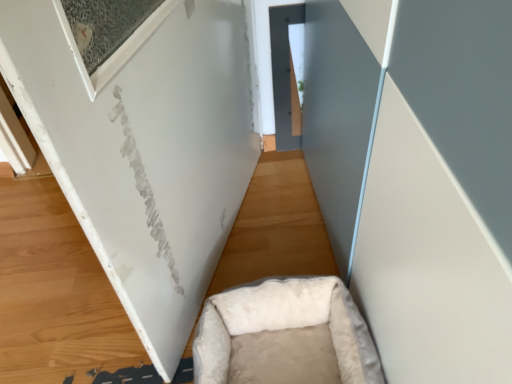
Question: From their relative heights in the image, would you say white fluffy pet bed at lower center is taller or shorter than white plush pet bed at lower center?

Choices:
 (A) tall
 (B) short

Answer: (B)

Question: Is point (101, 339) closer or farther from the camera than point (357, 377)?

Choices:
 (A) closer
 (B) farther

Answer: (B)

Question: Relative to white plush pet bed at lower center, is white fluffy pet bed at lower center in front or behind?

Choices:
 (A) front
 (B) behind

Answer: (B)

Question: Looking at the image, does white plush pet bed at lower center seem bigger or smaller compared to white fluffy pet bed at lower center?

Choices:
 (A) small
 (B) big

Answer: (A)

Question: Is point (x=369, y=352) positioned closer to the camera than point (x=218, y=283)?

Choices:
 (A) closer
 (B) farther

Answer: (A)

Question: Choose the correct answer: Is white plush pet bed at lower center inside white fluffy pet bed at lower center or outside it?

Choices:
 (A) inside
 (B) outside

Answer: (B)

Question: From a real-world perspective, is white plush pet bed at lower center positioned above or below white fluffy pet bed at lower center?

Choices:
 (A) below
 (B) above

Answer: (B)